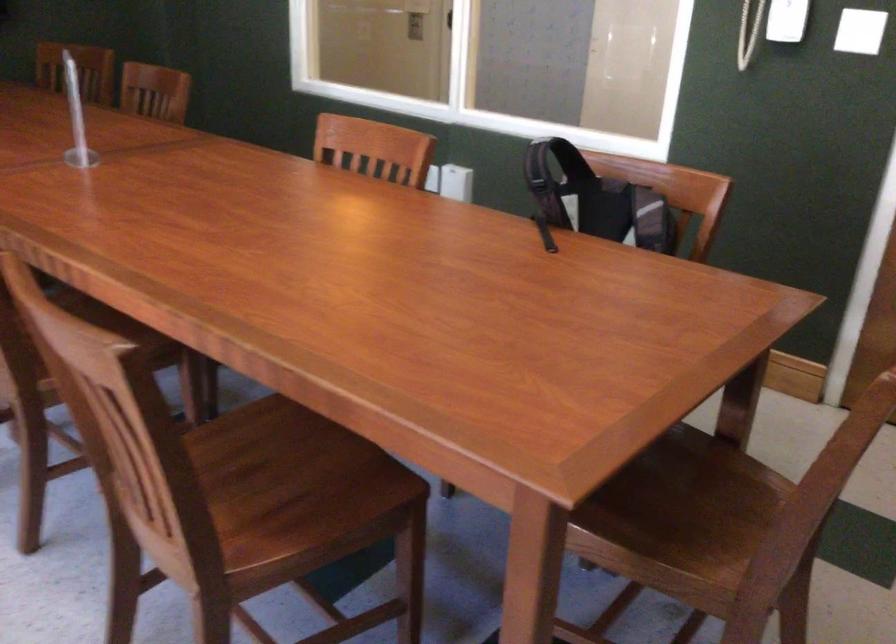
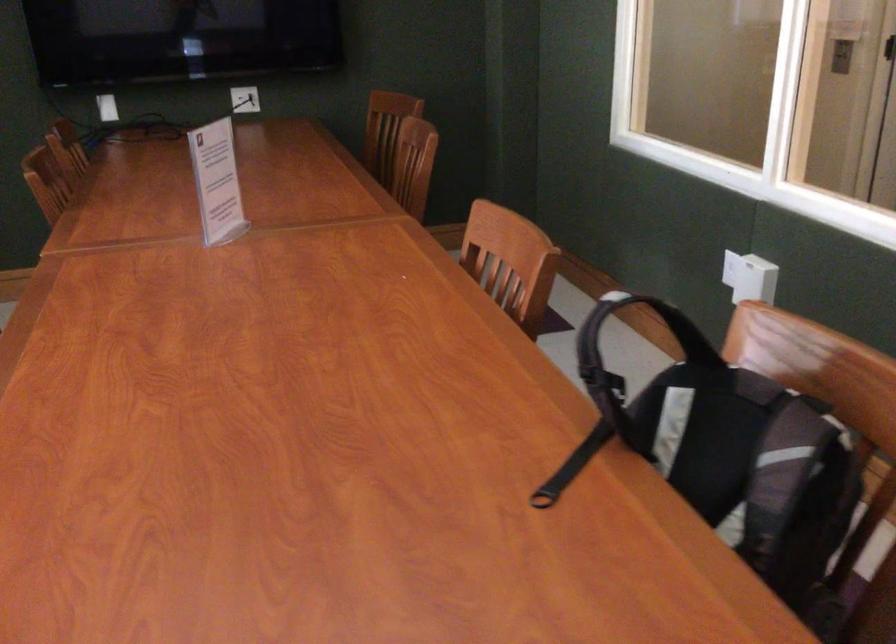
Question: I am providing you with two images of the same scene from different viewpoints. Which of the following objects are not visible in image2?

Choices:
 (A) backpack handle
 (B) backpack strap
 (C) plastic sign holder
 (D) none of these

Answer: (D)